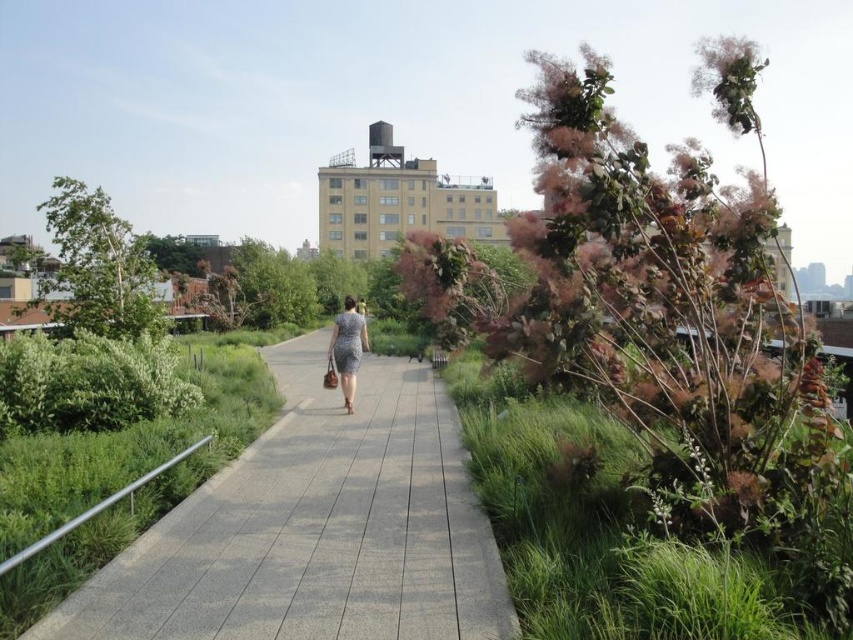
Between green grass at right and patterned fabric dress at center, which one appears on the left side from the viewer's perspective?

patterned fabric dress at center is more to the left.

Is point (811, 632) farther from camera compared to point (357, 312)?

No, (811, 632) is closer to viewer.

The height and width of the screenshot is (640, 853). What do you see at coordinates (601, 529) in the screenshot? I see `green grass at right` at bounding box center [601, 529].

The width and height of the screenshot is (853, 640). Identify the location of green grass at right. (601, 529).